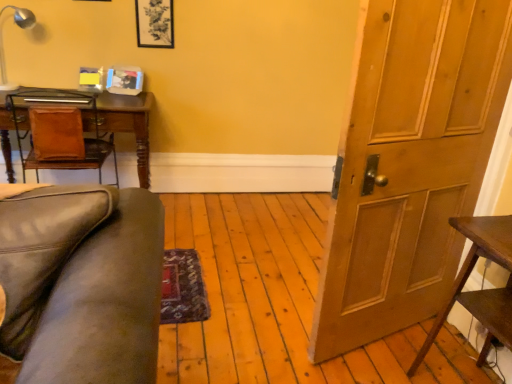
Question: Is dark brown wooden table at right positioned far away from wooden door at right?

Choices:
 (A) no
 (B) yes

Answer: (A)

Question: Is dark brown wooden table at right to the left of wooden door at right from the viewer's perspective?

Choices:
 (A) no
 (B) yes

Answer: (A)

Question: From a real-world perspective, is dark brown wooden table at right physically below wooden door at right?

Choices:
 (A) no
 (B) yes

Answer: (B)

Question: From a real-world perspective, is dark brown wooden table at right on top of wooden door at right?

Choices:
 (A) yes
 (B) no

Answer: (B)

Question: Is dark brown wooden table at right aimed at wooden door at right?

Choices:
 (A) yes
 (B) no

Answer: (B)

Question: Considering the positions of matte black picture frame at upper center and dark brown wooden table at right in the image, is matte black picture frame at upper center bigger or smaller than dark brown wooden table at right?

Choices:
 (A) big
 (B) small

Answer: (B)

Question: Is matte black picture frame at upper center spatially inside dark brown wooden table at right, or outside of it?

Choices:
 (A) inside
 (B) outside

Answer: (B)

Question: In the image, is matte black picture frame at upper center on the left side or the right side of dark brown wooden table at right?

Choices:
 (A) left
 (B) right

Answer: (A)

Question: Is point (165, 3) closer or farther from the camera than point (475, 297)?

Choices:
 (A) farther
 (B) closer

Answer: (A)

Question: Is dark brown wooden table at right inside the boundaries of metallic silver lamp at upper left, or outside?

Choices:
 (A) inside
 (B) outside

Answer: (B)

Question: Relative to metallic silver lamp at upper left, is dark brown wooden table at right in front or behind?

Choices:
 (A) front
 (B) behind

Answer: (A)

Question: Is dark brown wooden table at right to the left or to the right of metallic silver lamp at upper left in the image?

Choices:
 (A) right
 (B) left

Answer: (A)

Question: Is dark brown wooden table at right wider or thinner than metallic silver lamp at upper left?

Choices:
 (A) thin
 (B) wide

Answer: (B)

Question: Does point (10, 104) appear closer or farther from the camera than point (3, 89)?

Choices:
 (A) farther
 (B) closer

Answer: (A)

Question: Is brown leather desk at left to the left or to the right of metallic silver lamp at upper left in the image?

Choices:
 (A) right
 (B) left

Answer: (A)